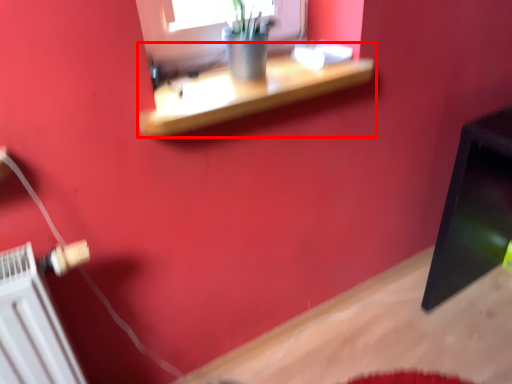
Question: Observing the image, what is the correct spatial positioning of shelf (annotated by the red box) in reference to radiator?

Choices:
 (A) left
 (B) right

Answer: (B)